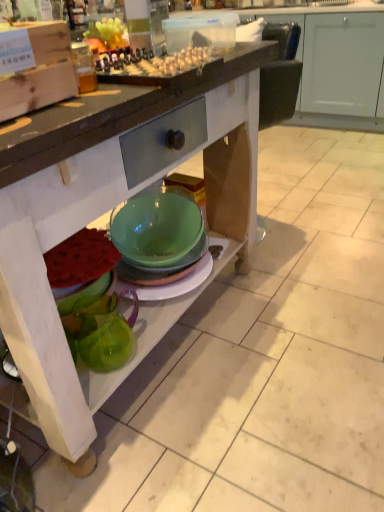
Question: Considering the relative positions of matte wood cabinet at upper center and translucent plastic container at upper center in the image provided, is matte wood cabinet at upper center to the left of translucent plastic container at upper center from the viewer's perspective?

Choices:
 (A) no
 (B) yes

Answer: (A)

Question: Is translucent plastic container at upper center at the back of matte wood cabinet at upper center?

Choices:
 (A) no
 (B) yes

Answer: (A)

Question: Is the depth of matte wood cabinet at upper center less than that of translucent plastic container at upper center?

Choices:
 (A) no
 (B) yes

Answer: (A)

Question: Considering the relative sizes of matte wood cabinet at upper center and translucent plastic container at upper center in the image provided, is matte wood cabinet at upper center wider than translucent plastic container at upper center?

Choices:
 (A) yes
 (B) no

Answer: (A)

Question: From a real-world perspective, is matte wood cabinet at upper center positioned over translucent plastic container at upper center based on gravity?

Choices:
 (A) no
 (B) yes

Answer: (A)

Question: From the image's perspective, is translucent plastic container at upper center above or below green glass pitcher at lower left?

Choices:
 (A) below
 (B) above

Answer: (B)

Question: Which is correct: translucent plastic container at upper center is inside green glass pitcher at lower left, or outside of it?

Choices:
 (A) inside
 (B) outside

Answer: (B)

Question: Considering the positions of translucent plastic container at upper center and green glass pitcher at lower left in the image, is translucent plastic container at upper center wider or thinner than green glass pitcher at lower left?

Choices:
 (A) wide
 (B) thin

Answer: (A)

Question: Is point (185, 67) positioned closer to the camera than point (107, 329)?

Choices:
 (A) closer
 (B) farther

Answer: (A)

Question: Considering the positions of green glass bowl at lower center and green glass pitcher at lower left in the image, is green glass bowl at lower center wider or thinner than green glass pitcher at lower left?

Choices:
 (A) thin
 (B) wide

Answer: (B)

Question: From the image's perspective, is green glass bowl at lower center positioned above or below green glass pitcher at lower left?

Choices:
 (A) above
 (B) below

Answer: (A)

Question: In the image, is green glass bowl at lower center on the left side or the right side of green glass pitcher at lower left?

Choices:
 (A) left
 (B) right

Answer: (B)

Question: From a real-world perspective, relative to green glass pitcher at lower left, is green glass bowl at lower center vertically above or below?

Choices:
 (A) below
 (B) above

Answer: (B)

Question: Considering the positions of green glass pitcher at lower left and matte wood cabinet at upper center in the image, is green glass pitcher at lower left bigger or smaller than matte wood cabinet at upper center?

Choices:
 (A) small
 (B) big

Answer: (A)

Question: Is green glass pitcher at lower left wider or thinner than matte wood cabinet at upper center?

Choices:
 (A) thin
 (B) wide

Answer: (A)